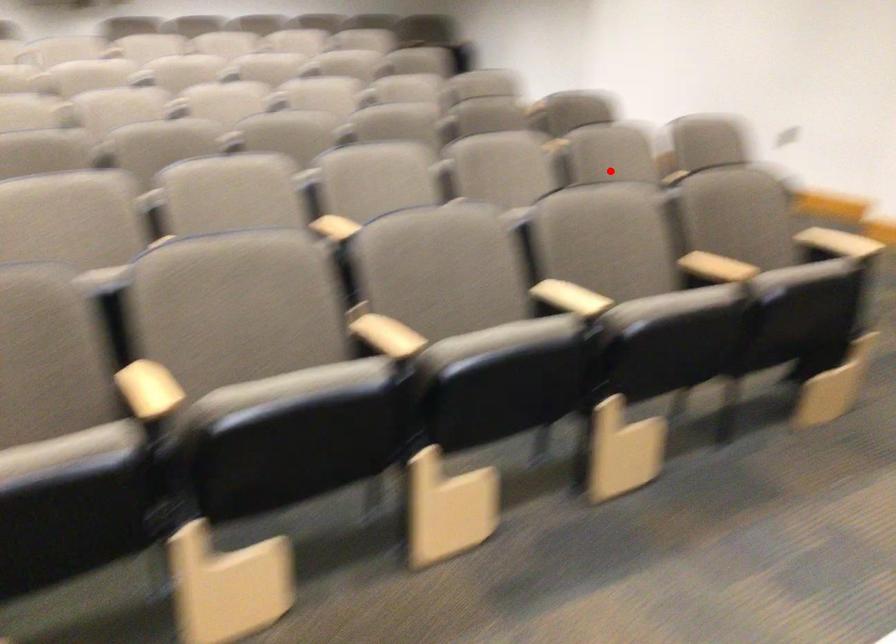
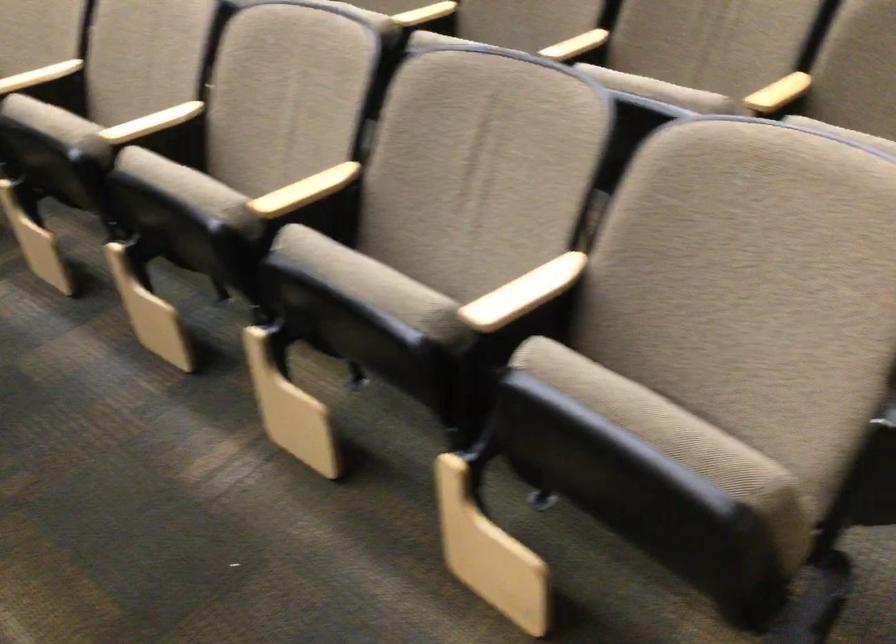
Question: I am providing you with two images of the same scene from different viewpoints. A red point is shown in image1. For the corresponding object point in image2, is it positioned nearer or farther from the camera?

Choices:
 (A) Nearer
 (B) Farther

Answer: (A)